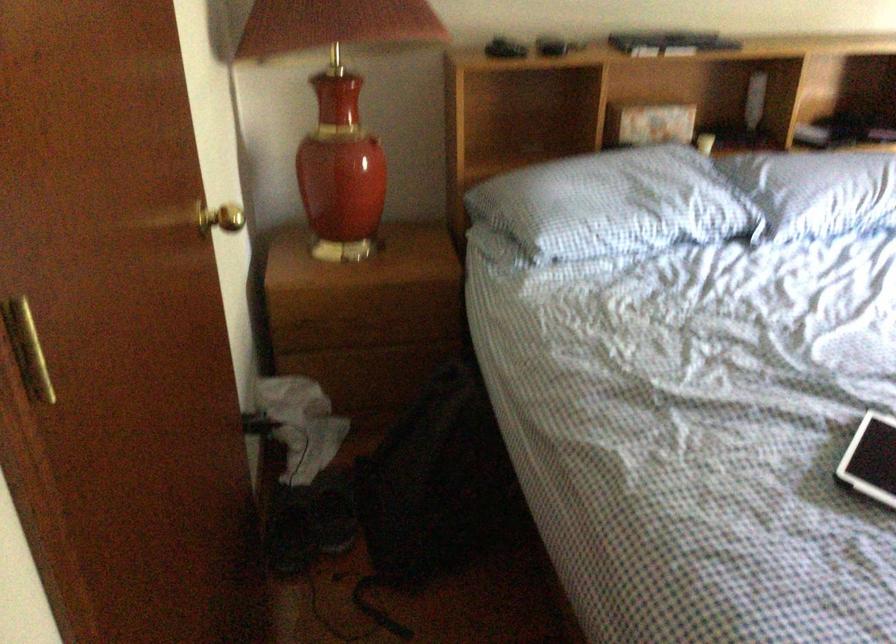
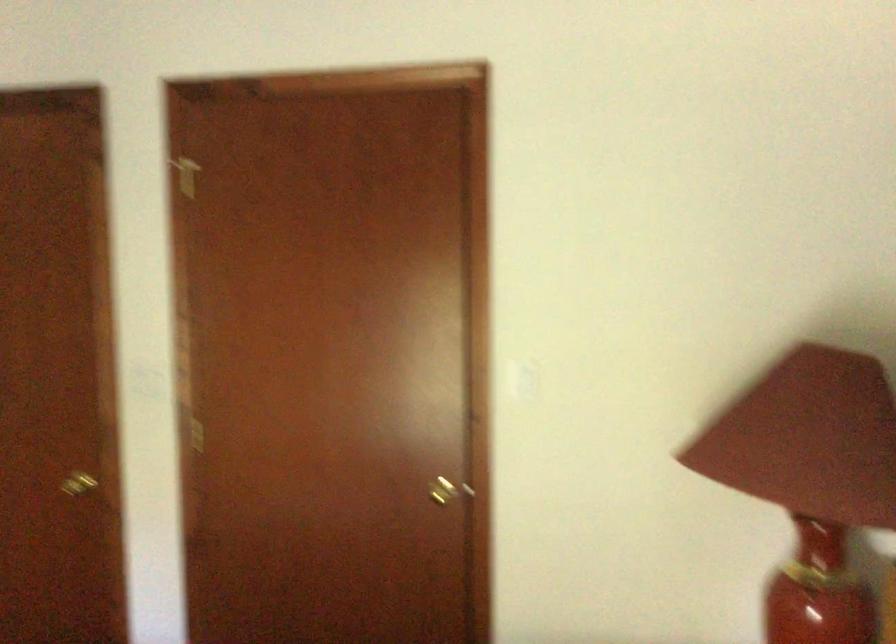
Locate, in the second image, the point that corresponds to point (193, 236) in the first image.

(446, 489)